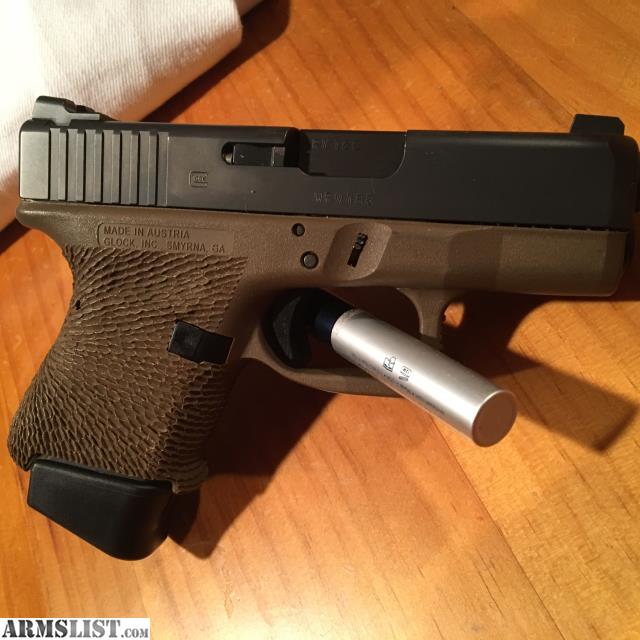
Identify the location of light reflecting on wooden tabletop. This screenshot has height=640, width=640. (281, 630).